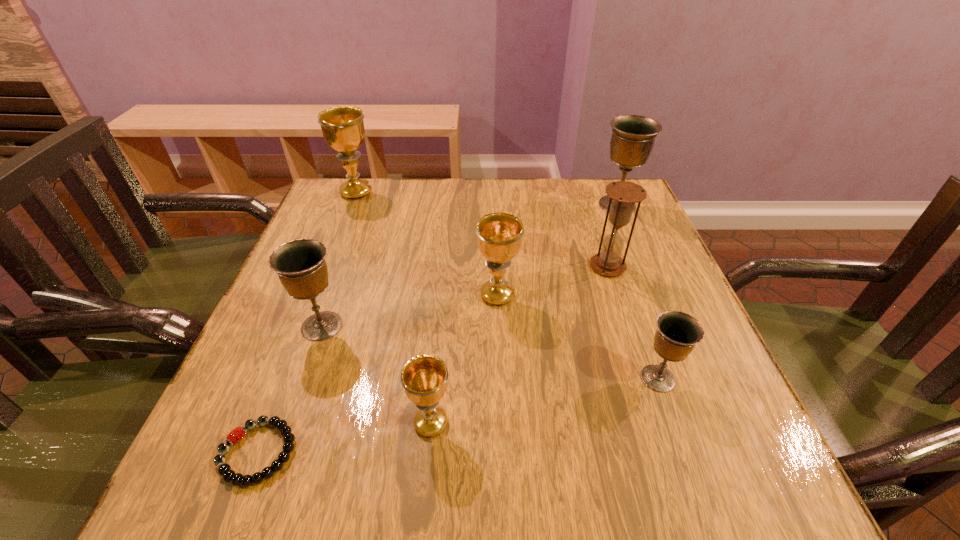
The height and width of the screenshot is (540, 960). In order to click on free spot between the smallest gold chalice and the leftmost bronze chalice in this screenshot , I will do `click(376, 375)`.

This screenshot has width=960, height=540. I want to click on free space between the second biggest bronze chalice and the brown hourglass, so (465, 296).

The width and height of the screenshot is (960, 540). What are the coordinates of `vacant space that's between the farthest bronze chalice and the leftmost gold chalice` in the screenshot? It's located at (487, 198).

What are the coordinates of `vacant area between the second gold chalice from right to left and the shortest object` in the screenshot? It's located at (345, 438).

Find the location of a particular element. the fifth closest object relative to the nearest bronze chalice is located at coordinates (300, 264).

Select which object is the third closest to the leftmost bronze chalice. Please provide its 2D coordinates. Your answer should be formatted as a tuple, i.e. [(x, y)], where the tuple contains the x and y coordinates of a point satisfying the conditions above.

[(499, 235)]

Select which chalice is the fifth closest to the second biggest gold chalice. Please provide its 2D coordinates. Your answer should be formatted as a tuple, i.e. [(x, y)], where the tuple contains the x and y coordinates of a point satisfying the conditions above.

[(343, 129)]

You are a GUI agent. You are given a task and a screenshot of the screen. Output one action in this format:
    pyautogui.click(x=<x>, y=<y>)
    Task: Click on the fourth closest chalice relative to the biggest bronze chalice
    This screenshot has height=540, width=960.
    Given the screenshot: What is the action you would take?
    pyautogui.click(x=424, y=378)

Choose which gold chalice is the nearest neighbor to the second smallest gold chalice. Please provide its 2D coordinates. Your answer should be formatted as a tuple, i.e. [(x, y)], where the tuple contains the x and y coordinates of a point satisfying the conditions above.

[(424, 378)]

At what (x,y) coordinates should I click in order to perform the action: click on gold chalice that is the second closest to the fourth chalice from left to right. Please return your answer as a coordinate pair (x, y). Image resolution: width=960 pixels, height=540 pixels. Looking at the image, I should click on (343, 129).